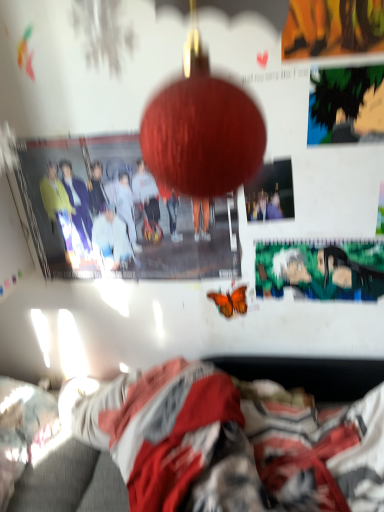
Question: Considering the relative sizes of fluffy blanket at lower center and orange matte butterfly at center in the image provided, is fluffy blanket at lower center bigger than orange matte butterfly at center?

Choices:
 (A) no
 (B) yes

Answer: (B)

Question: From the image's perspective, is fluffy blanket at lower center beneath orange matte butterfly at center?

Choices:
 (A) yes
 (B) no

Answer: (A)

Question: Is fluffy blanket at lower center behind orange matte butterfly at center?

Choices:
 (A) no
 (B) yes

Answer: (A)

Question: Can you confirm if fluffy blanket at lower center is positioned to the right of orange matte butterfly at center?

Choices:
 (A) yes
 (B) no

Answer: (B)

Question: Does fluffy blanket at lower center have a greater height compared to orange matte butterfly at center?

Choices:
 (A) no
 (B) yes

Answer: (B)

Question: Is fluffy blanket at lower center positioned with its back to orange matte butterfly at center?

Choices:
 (A) no
 (B) yes

Answer: (A)

Question: Does matte paper poster at center, the second poster page viewed from the top, touch green matte poster at center, the 1th poster page from the back?

Choices:
 (A) no
 (B) yes

Answer: (A)

Question: Is matte paper poster at center, the second poster page viewed from the top, oriented away from green matte poster at center, which ranks as the 3th poster page in top-to-bottom order?

Choices:
 (A) yes
 (B) no

Answer: (B)

Question: Is matte paper poster at center, which is counted as the second poster page, starting from the bottom, taller than green matte poster at center, positioned as the first poster page in bottom-to-top order?

Choices:
 (A) yes
 (B) no

Answer: (B)

Question: Is matte paper poster at center, positioned as the second poster page in back-to-front order, thinner than green matte poster at center, which ranks as the 3th poster page in front-to-back order?

Choices:
 (A) yes
 (B) no

Answer: (B)

Question: Could you tell me if matte paper poster at center, which ranks as the second poster page in front-to-back order, is turned towards green matte poster at center, which ranks as the 3th poster page in top-to-bottom order?

Choices:
 (A) no
 (B) yes

Answer: (A)

Question: Can you confirm if matte paper poster at center, which is counted as the second poster page, starting from the bottom, is shorter than green matte poster at center, which ranks as the 3th poster page in front-to-back order?

Choices:
 (A) yes
 (B) no

Answer: (A)

Question: From the image's perspective, is fluffy white pillow at lower left below fluffy blanket at lower center?

Choices:
 (A) yes
 (B) no

Answer: (B)